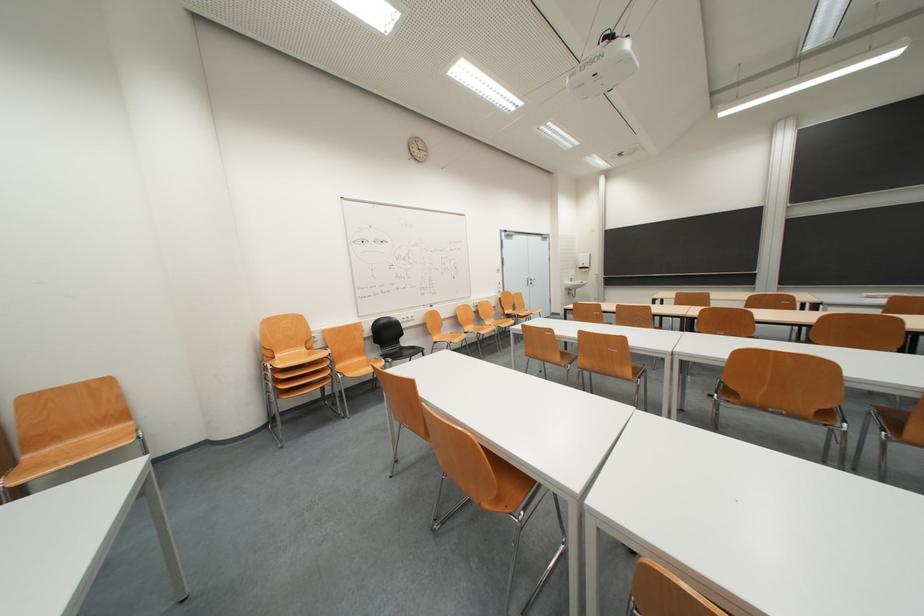
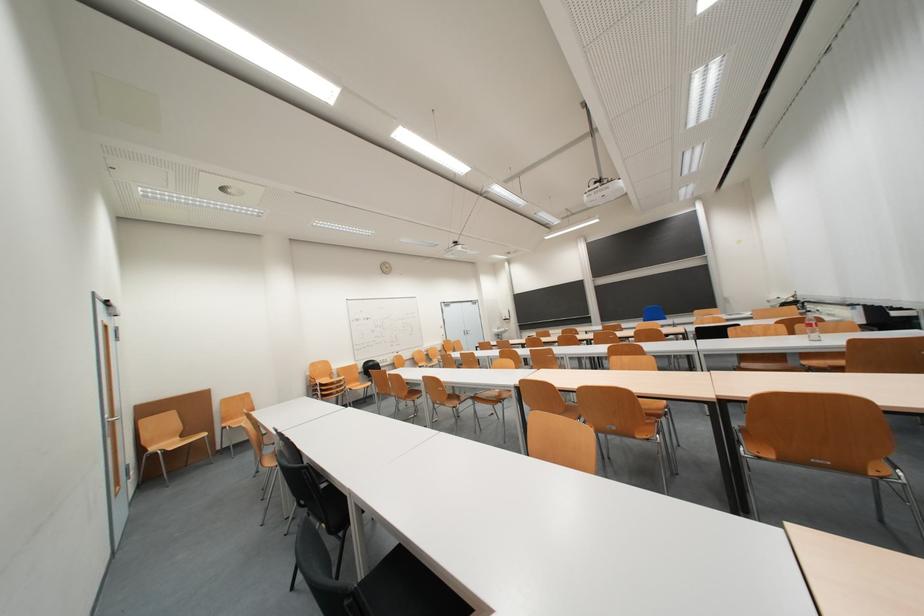
Find the pixel in the second image that matches (325,331) in the first image.

(343, 371)